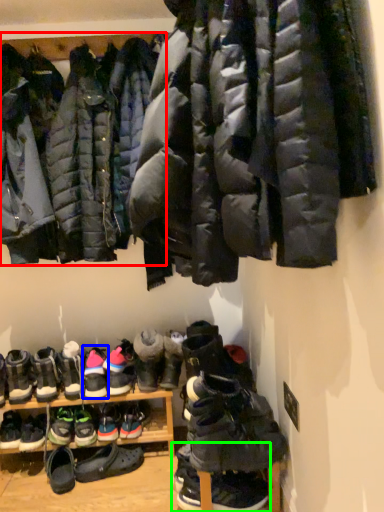
Question: Estimate the real-world distances between objects in this image. Which object is closer to jacket (highlighted by a red box), footwear (highlighted by a blue box) or footwear (highlighted by a green box)?

Choices:
 (A) footwear
 (B) footwear

Answer: (A)